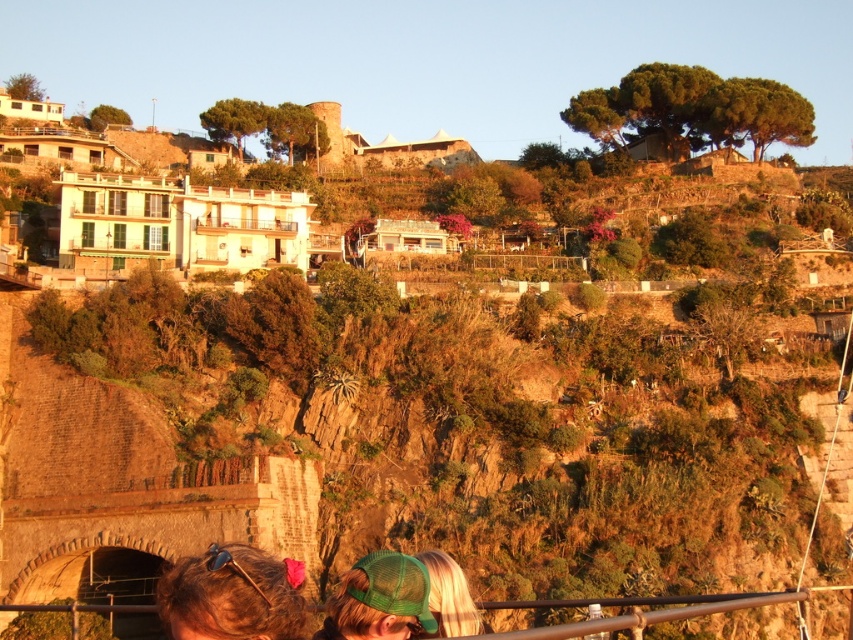
Question: Where is green mesh cap at lower center located in relation to brown hair at lower left in the image?

Choices:
 (A) above
 (B) below

Answer: (B)

Question: Estimate the real-world distances between objects in this image. Which object is farther from the green mesh cap at lower center?

Choices:
 (A) blonde hair at lower center
 (B) brown hair at lower left

Answer: (A)

Question: Does green mesh cap at lower center come in front of blonde hair at lower center?

Choices:
 (A) yes
 (B) no

Answer: (A)

Question: From the image, what is the correct spatial relationship of green mesh cap at lower center in relation to brown hair at lower left?

Choices:
 (A) below
 (B) above

Answer: (A)

Question: Which object is the farthest from the blonde hair at lower center?

Choices:
 (A) green mesh cap at lower center
 (B) brown hair at lower left

Answer: (B)

Question: Which of the following is the closest to the observer?

Choices:
 (A) blonde hair at lower center
 (B) brown hair at lower left

Answer: (B)